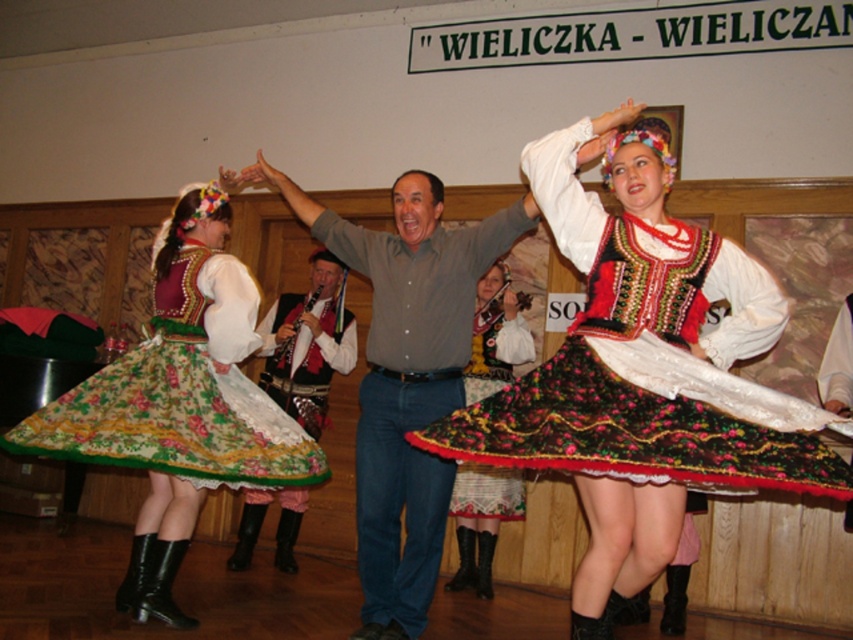
Question: Among these points, which one is farthest from the camera?

Choices:
 (A) click(660, 477)
 (B) click(321, 376)
 (C) click(178, 624)
 (D) click(485, 484)

Answer: (B)

Question: Which point is farther to the camera?

Choices:
 (A) floral-patterned fabric skirt at center
 (B) floral cotton skirt at center
 (C) matte gray shirt at center
 (D) floral-patterned skirt at center

Answer: (D)

Question: Can you confirm if floral cotton skirt at center is positioned below floral-patterned fabric skirt at center?

Choices:
 (A) no
 (B) yes

Answer: (A)

Question: Considering the real-world distances, which object is farthest from the floral-patterned fabric skirt at center?

Choices:
 (A) matte gray shirt at center
 (B) floral cotton skirt at center
 (C) floral-patterned skirt at center
 (D) floral fabric skirt at center

Answer: (C)

Question: Is matte gray shirt at center wider than floral-patterned skirt at center?

Choices:
 (A) no
 (B) yes

Answer: (B)

Question: Is matte gray shirt at center wider than floral fabric skirt at center?

Choices:
 (A) no
 (B) yes

Answer: (B)